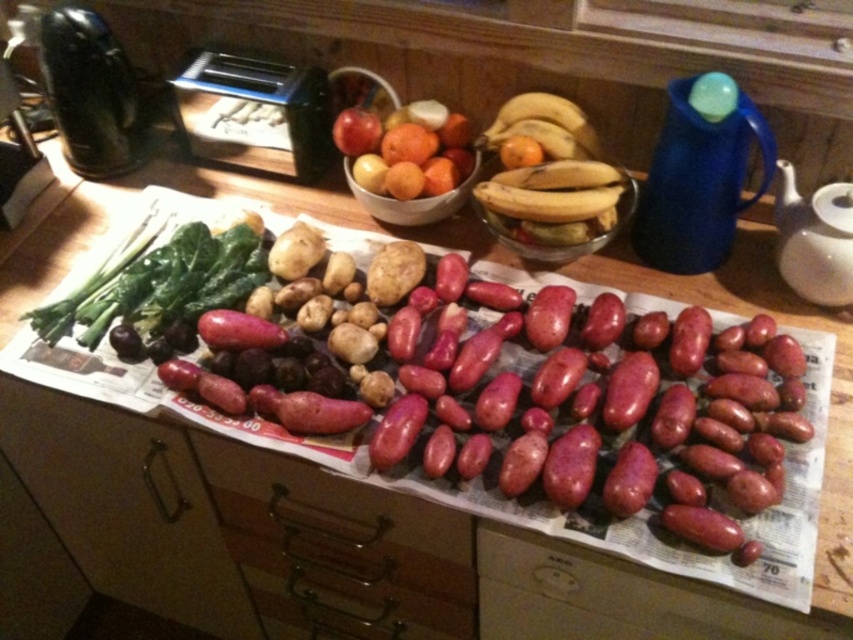
You are organizing vegetables on a kitchen counter. You have a green leafy at left and a glossy plastic bowl at center. Which one has a greater width?

The green leafy at left has a greater width than the glossy plastic bowl at center.

You are organizing the items on the kitchen countertop. You need to place a tall vase that requires more vertical space. Which item between the green leafy at left and the glossy plastic bowl at center should you move to accommodate the vase?

The green leafy at left has a greater height compared to the glossy plastic bowl at center, so you should move the green leafy at left to accommodate the tall vase that needs more vertical space.